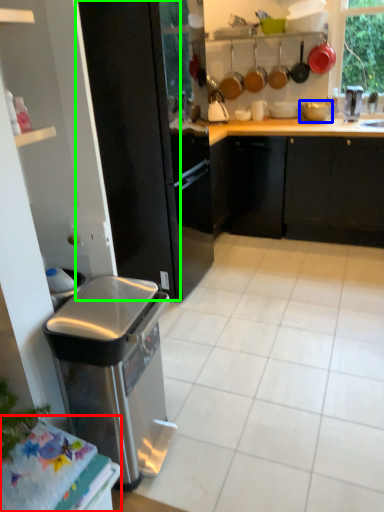
Question: Which object is the farthest from table (highlighted by a red box)? Choose among these: appliance (highlighted by a blue box) or screen door (highlighted by a green box).

Choices:
 (A) appliance
 (B) screen door

Answer: (A)